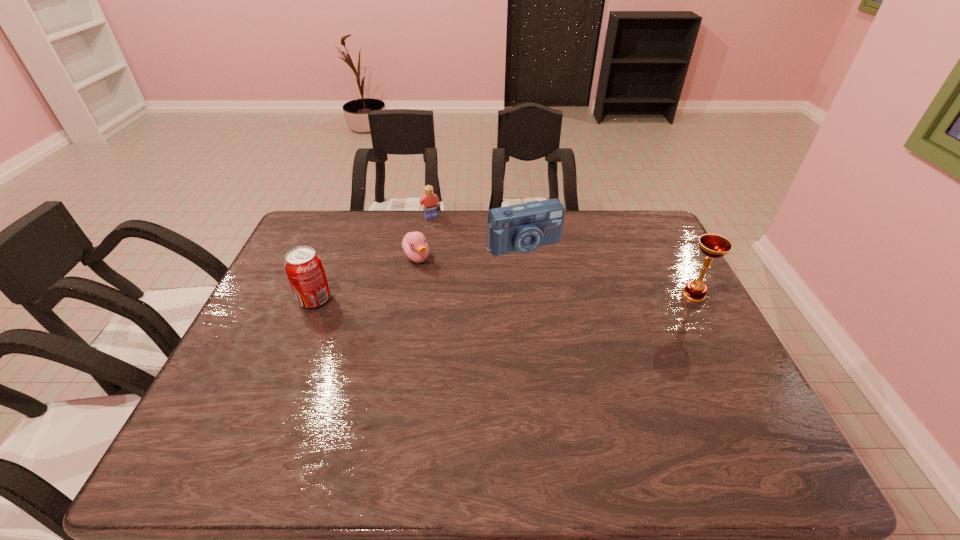
Identify the location of free spot located on the front-facing side of the Lego. (454, 252).

Locate an element on the screen. vacant space located 0.380m on the front-facing side of the Lego is located at coordinates 474,287.

Identify the location of vacant region located 0.070m on the front-facing side of the Lego. (441, 230).

Find the location of a particular element. The height and width of the screenshot is (540, 960). vacant point located 0.100m on the lens of the second object from right to left is located at coordinates (550, 278).

The width and height of the screenshot is (960, 540). I want to click on free location located 0.230m on the lens of the second object from right to left, so click(568, 307).

Locate an element on the screen. This screenshot has width=960, height=540. vacant space located on the lens of the second object from right to left is located at coordinates (582, 328).

The width and height of the screenshot is (960, 540). In order to click on duckling at the far edge in this screenshot , I will do `click(414, 244)`.

Identify the location of Lego that is at the far edge. (430, 201).

In order to click on camera at the far edge in this screenshot , I will do `click(523, 228)`.

Locate an element on the screen. object that is at the left edge is located at coordinates (303, 266).